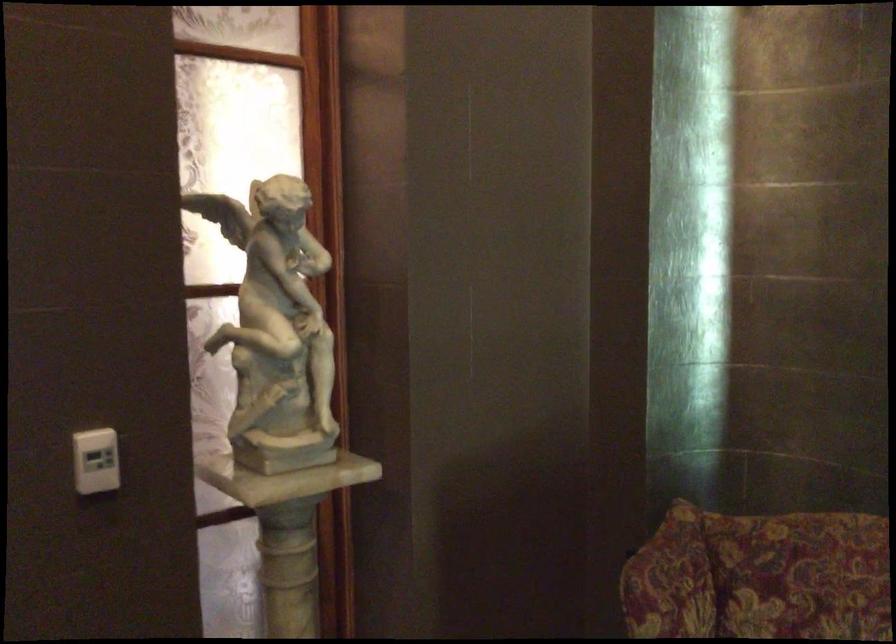
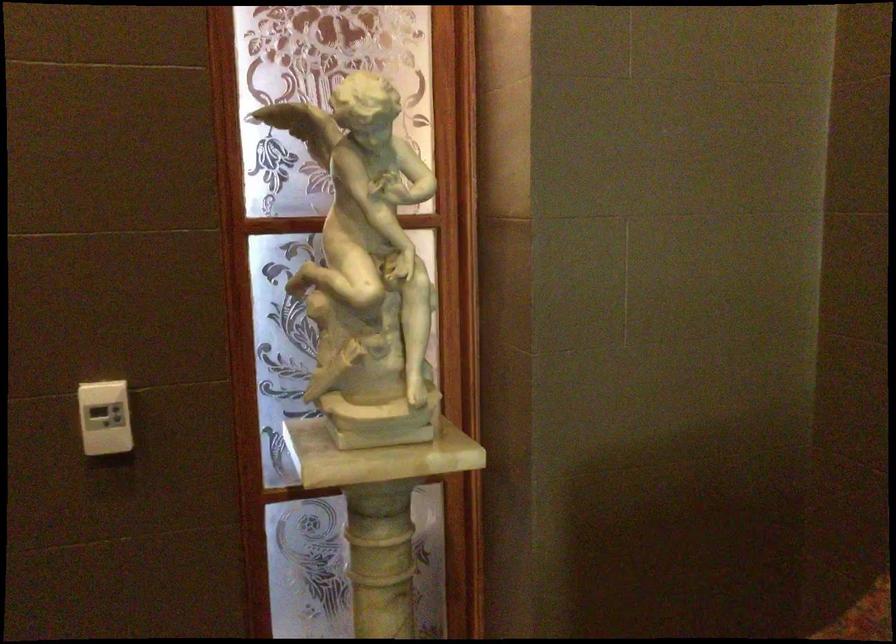
The images are taken continuously from a first-person perspective. In which direction are you moving?

The cameraman moved toward right, forward.